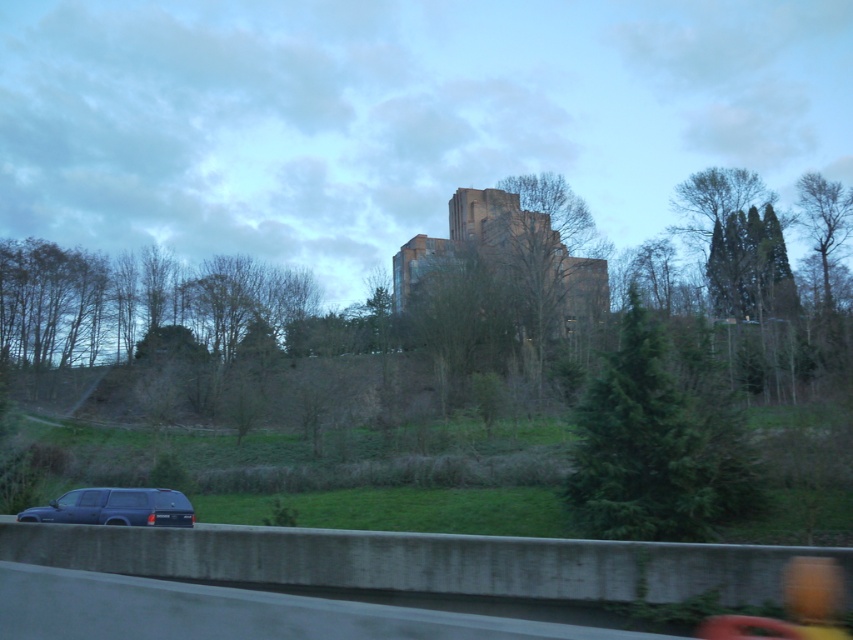
You are a photographer trying to capture both the rustic stone castle at center and the matte black suv at lower left in a single frame. Considering their sizes, which object should you focus on to ensure both are clearly visible in your photo?

The rustic stone castle at center is larger than the matte black suv at lower left, so focusing on the castle will help ensure both are clearly visible in the photo.